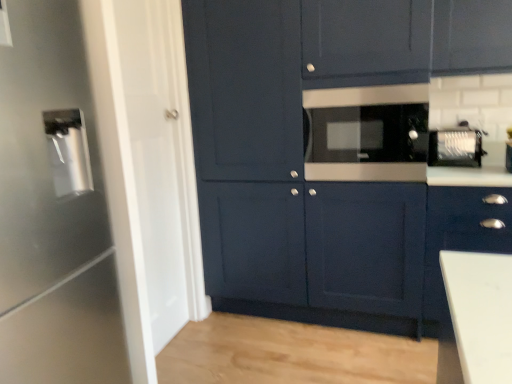
Question: Is satin silver water dispenser at left, which ranks as the 3th appliance in back-to-front order, far away from satin silver toaster at upper right, which ranks as the 3th appliance in front-to-back order?

Choices:
 (A) yes
 (B) no

Answer: (A)

Question: Could you tell me if satin silver water dispenser at left, which is counted as the 3th appliance, starting from the right, is facing satin silver toaster at upper right, the 1th appliance from the right?

Choices:
 (A) no
 (B) yes

Answer: (A)

Question: Is satin silver toaster at upper right, which ranks as the 3th appliance in front-to-back order, surrounded by satin silver water dispenser at left, which is counted as the 3th appliance, starting from the right?

Choices:
 (A) yes
 (B) no

Answer: (B)

Question: From the image's perspective, is satin silver water dispenser at left, positioned as the first appliance in left-to-right order, below satin silver toaster at upper right, the 1th appliance from the right?

Choices:
 (A) no
 (B) yes

Answer: (B)

Question: Is satin silver water dispenser at left, which is counted as the 3th appliance, starting from the right, shorter than satin silver toaster at upper right, which ranks as the 3th appliance in left-to-right order?

Choices:
 (A) yes
 (B) no

Answer: (B)

Question: From a real-world perspective, is satin silver toaster at upper right, which ranks as the 3th appliance in left-to-right order, above or below satin black microwave at center, the second appliance when ordered from left to right?

Choices:
 (A) below
 (B) above

Answer: (A)

Question: Relative to satin black microwave at center, the second appliance from the back, is satin silver toaster at upper right, which ranks as the 3th appliance in left-to-right order, in front or behind?

Choices:
 (A) behind
 (B) front

Answer: (A)

Question: In the image, is satin silver toaster at upper right, which ranks as the 3th appliance in front-to-back order, on the left side or the right side of satin black microwave at center, the second appliance from the back?

Choices:
 (A) right
 (B) left

Answer: (A)

Question: From the image's perspective, is satin silver toaster at upper right, which ranks as the 3th appliance in left-to-right order, above or below satin black microwave at center, the second appliance when ordered from right to left?

Choices:
 (A) below
 (B) above

Answer: (A)

Question: Is point (476, 208) closer or farther from the camera than point (232, 246)?

Choices:
 (A) closer
 (B) farther

Answer: (A)

Question: In the image, is matte dark blue cabinet at lower right, which is the second cabinetry from left to right, positioned in front of or behind matte dark blue cabinet at center, which is counted as the 2th cabinetry, starting from the right?

Choices:
 (A) behind
 (B) front

Answer: (A)

Question: From a real-world perspective, relative to matte dark blue cabinet at center, which is counted as the 2th cabinetry, starting from the right, is matte dark blue cabinet at lower right, acting as the 1th cabinetry starting from the right, vertically above or below?

Choices:
 (A) above
 (B) below

Answer: (B)

Question: Looking at their shapes, would you say matte dark blue cabinet at lower right, acting as the 1th cabinetry starting from the right, is wider or thinner than matte dark blue cabinet at center, arranged as the first cabinetry when viewed from the left?

Choices:
 (A) thin
 (B) wide

Answer: (A)

Question: Considering the positions of satin black microwave at center, the second appliance from the back, and satin silver toaster at upper right, which ranks as the 3th appliance in left-to-right order, in the image, is satin black microwave at center, the second appliance from the back, bigger or smaller than satin silver toaster at upper right, which ranks as the 3th appliance in left-to-right order,?

Choices:
 (A) small
 (B) big

Answer: (B)

Question: In the image, is satin black microwave at center, the second appliance from the back, positioned in front of or behind satin silver toaster at upper right, the first appliance viewed from the back?

Choices:
 (A) front
 (B) behind

Answer: (A)